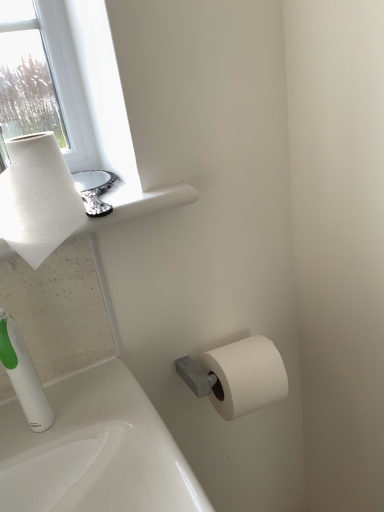
Question: Is white matte paper towel at upper left further to the viewer compared to white textured paper towel at upper left?

Choices:
 (A) yes
 (B) no

Answer: (A)

Question: Is the position of white matte paper towel at upper left less distant than that of white textured paper towel at upper left?

Choices:
 (A) yes
 (B) no

Answer: (B)

Question: Is white matte paper towel at upper left located outside white textured paper towel at upper left?

Choices:
 (A) yes
 (B) no

Answer: (A)

Question: Is white matte paper towel at upper left thinner than white textured paper towel at upper left?

Choices:
 (A) no
 (B) yes

Answer: (A)

Question: Considering the relative sizes of white matte paper towel at upper left and white textured paper towel at upper left in the image provided, is white matte paper towel at upper left smaller than white textured paper towel at upper left?

Choices:
 (A) yes
 (B) no

Answer: (B)

Question: Does point (31, 154) appear closer or farther from the camera than point (193, 189)?

Choices:
 (A) closer
 (B) farther

Answer: (A)

Question: Considering the relative positions of white textured paper towel at upper left and white matte paper towel at upper left in the image provided, is white textured paper towel at upper left to the left or to the right of white matte paper towel at upper left?

Choices:
 (A) right
 (B) left

Answer: (B)

Question: From a real-world perspective, is white textured paper towel at upper left positioned above or below white matte paper towel at upper left?

Choices:
 (A) above
 (B) below

Answer: (A)

Question: From the image's perspective, is white textured paper towel at upper left positioned above or below white matte paper towel at upper left?

Choices:
 (A) above
 (B) below

Answer: (B)

Question: Based on their sizes in the image, would you say white matte toilet paper at lower right is bigger or smaller than white plastic soap dispenser at lower left?

Choices:
 (A) small
 (B) big

Answer: (B)

Question: From the image's perspective, is white matte toilet paper at lower right located above or below white plastic soap dispenser at lower left?

Choices:
 (A) below
 (B) above

Answer: (A)

Question: Considering the positions of point (220, 373) and point (3, 316), is point (220, 373) closer or farther from the camera than point (3, 316)?

Choices:
 (A) closer
 (B) farther

Answer: (B)

Question: Considering their positions, is white matte toilet paper at lower right located in front of or behind white plastic soap dispenser at lower left?

Choices:
 (A) behind
 (B) front

Answer: (A)

Question: From the image's perspective, is white matte paper towel at upper left positioned above or below white textured paper towel at upper left?

Choices:
 (A) above
 (B) below

Answer: (A)

Question: Is white matte paper towel at upper left inside or outside of white textured paper towel at upper left?

Choices:
 (A) inside
 (B) outside

Answer: (B)